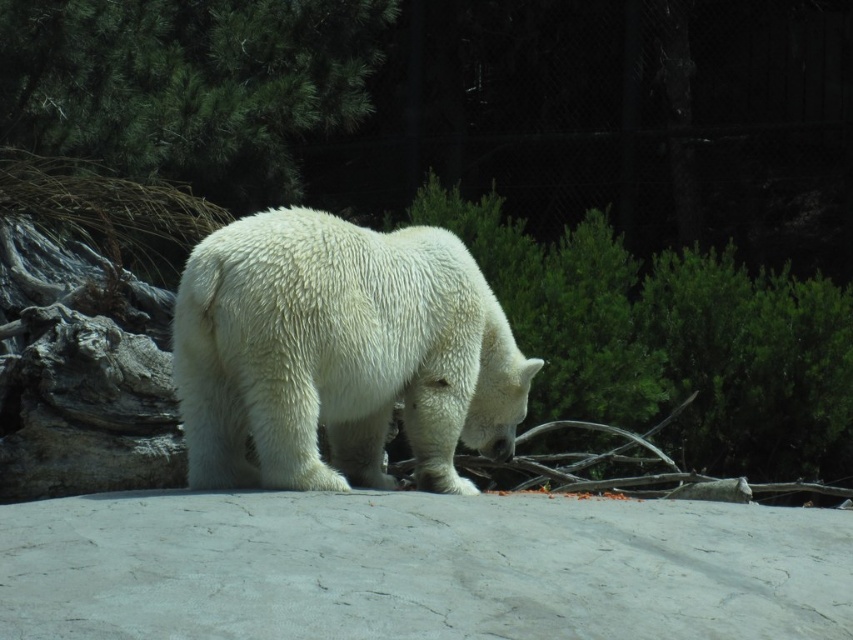
Which of these two, white fluffy bear at center or green textured pine tree at upper left, stands shorter?

With less height is white fluffy bear at center.

Between white fluffy bear at center and green textured pine tree at upper left, which one is positioned lower?

white fluffy bear at center

The height and width of the screenshot is (640, 853). Describe the element at coordinates (339, 353) in the screenshot. I see `white fluffy bear at center` at that location.

Image resolution: width=853 pixels, height=640 pixels. In order to click on white fluffy bear at center in this screenshot , I will do `click(339, 353)`.